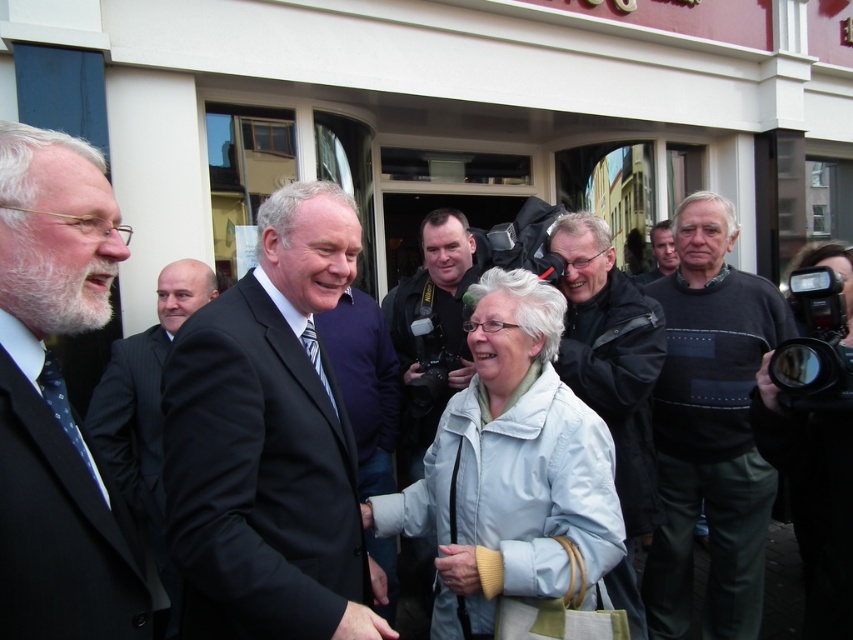
Can you confirm if dark gray sweater at right is positioned to the right of dark gray sweater at center?

Incorrect, dark gray sweater at right is not on the right side of dark gray sweater at center.

This screenshot has width=853, height=640. Describe the element at coordinates (711, 428) in the screenshot. I see `dark gray sweater at right` at that location.

Locate an element on the screen. dark gray sweater at right is located at coordinates (711, 428).

Does black suit at center lie in front of light blue fabric jacket at center?

That is True.

Which of these two, black suit at center or light blue fabric jacket at center, stands shorter?

light blue fabric jacket at center

Who is more forward, (335, 208) or (477, 403)?

Point (335, 208) is in front.

You are a GUI agent. You are given a task and a screenshot of the screen. Output one action in this format:
    pyautogui.click(x=<x>, y=<y>)
    Task: Click on the black suit at center
    
    Given the screenshot: What is the action you would take?
    click(267, 436)

Measure the distance between point (691, 330) and camera.

A distance of 3.58 meters exists between point (691, 330) and camera.

Does dark gray sweater at right come in front of black pinstripe suit at left?

That is False.

Who is more forward, (740,582) or (125,356)?

Point (740,582) is in front.

At what (x,y) coordinates should I click in order to perform the action: click on dark gray sweater at right. Please return your answer as a coordinate pair (x, y). Looking at the image, I should click on (711, 428).